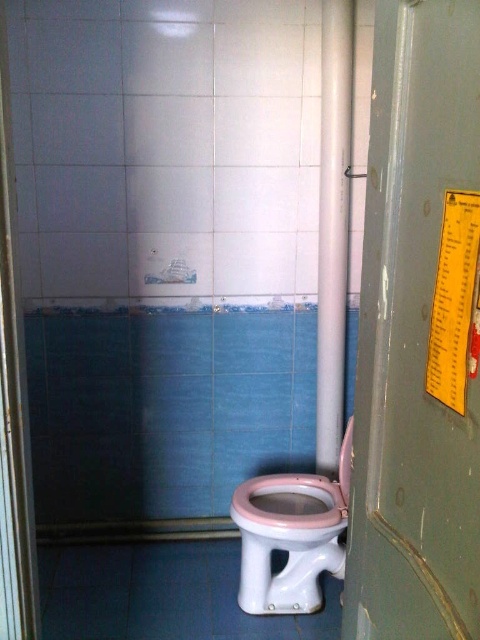
Can you confirm if pink glossy toilet bowl at center is positioned to the left of white glossy tile at upper center?

No, pink glossy toilet bowl at center is not to the left of white glossy tile at upper center.

Is point (264, 600) positioned in front of point (129, 128)?

Yes, point (264, 600) is closer to viewer.

From the picture: Who is more forward, (259, 515) or (187, 154)?

Point (259, 515) is more forward.

Find the location of a particular element. The image size is (480, 640). pink glossy toilet bowl at center is located at coordinates (290, 536).

Image resolution: width=480 pixels, height=640 pixels. Describe the element at coordinates (419, 333) in the screenshot. I see `green metallic pillar at right` at that location.

Does green metallic pillar at right have a lesser width compared to pink glossy toilet lid at center?

→ Indeed, green metallic pillar at right has a lesser width compared to pink glossy toilet lid at center.

Who is more forward, (394,97) or (346,472)?

Point (394,97)

At what (x,y) coordinates should I click in order to perform the action: click on green metallic pillar at right. Please return your answer as a coordinate pair (x, y). The width and height of the screenshot is (480, 640). Looking at the image, I should click on (419, 333).

Between green metallic pillar at right and white glossy pipe at center, which one appears on the left side from the viewer's perspective?

From the viewer's perspective, green metallic pillar at right appears more on the left side.

Can you confirm if green metallic pillar at right is positioned to the left of white glossy pipe at center?

Correct, you'll find green metallic pillar at right to the left of white glossy pipe at center.

The height and width of the screenshot is (640, 480). What are the coordinates of `green metallic pillar at right` in the screenshot? It's located at (419, 333).

Identify the location of green metallic pillar at right. (419, 333).